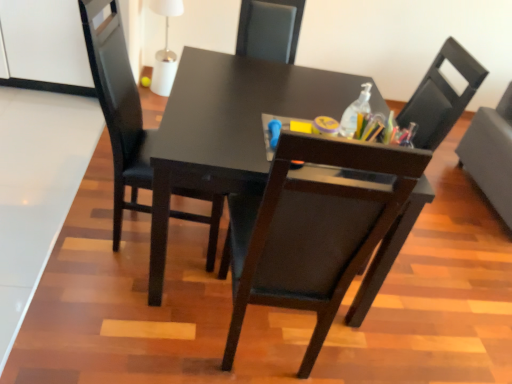
Question: From a real-world perspective, is black matte chair at right, acting as the 3th chair starting from the left, on clear plastic bottle at upper right?

Choices:
 (A) no
 (B) yes

Answer: (A)

Question: Is black matte chair at right, the 1th chair when ordered from right to left, positioned with its back to clear plastic bottle at upper right?

Choices:
 (A) yes
 (B) no

Answer: (B)

Question: Is black matte chair at right, acting as the 3th chair starting from the left, completely or partially outside of clear plastic bottle at upper right?

Choices:
 (A) no
 (B) yes

Answer: (B)

Question: Is black matte chair at right, acting as the 3th chair starting from the left, far away from clear plastic bottle at upper right?

Choices:
 (A) yes
 (B) no

Answer: (A)

Question: Does black matte chair at right, the 1th chair when ordered from right to left, come behind clear plastic bottle at upper right?

Choices:
 (A) yes
 (B) no

Answer: (A)

Question: Is black matte chair at right, acting as the 3th chair starting from the left, to the right of clear plastic bottle at upper right from the viewer's perspective?

Choices:
 (A) no
 (B) yes

Answer: (B)

Question: Is matte black chair at center, the first chair in the left-to-right sequence, positioned with its back to matte black chair at center, marked as the 2th chair in a right-to-left arrangement?

Choices:
 (A) no
 (B) yes

Answer: (A)

Question: Can you confirm if matte black chair at center, which ranks as the third chair in right-to-left order, is taller than matte black chair at center, the second chair from the left?

Choices:
 (A) yes
 (B) no

Answer: (B)

Question: From the image's perspective, is matte black chair at center, which ranks as the third chair in right-to-left order, beneath matte black chair at center, marked as the 2th chair in a right-to-left arrangement?

Choices:
 (A) no
 (B) yes

Answer: (A)

Question: Is matte black chair at center, which ranks as the third chair in right-to-left order, with matte black chair at center, the second chair from the left?

Choices:
 (A) no
 (B) yes

Answer: (A)

Question: Is matte black chair at center, which ranks as the third chair in right-to-left order, wider than matte black chair at center, marked as the 2th chair in a right-to-left arrangement?

Choices:
 (A) no
 (B) yes

Answer: (A)

Question: From a real-world perspective, does matte black chair at center, the first chair in the left-to-right sequence, stand above matte black chair at center, the second chair from the left?

Choices:
 (A) no
 (B) yes

Answer: (B)

Question: Does clear plastic bottle at upper right have a lesser height compared to matte black chair at center, the second chair from the left?

Choices:
 (A) yes
 (B) no

Answer: (A)